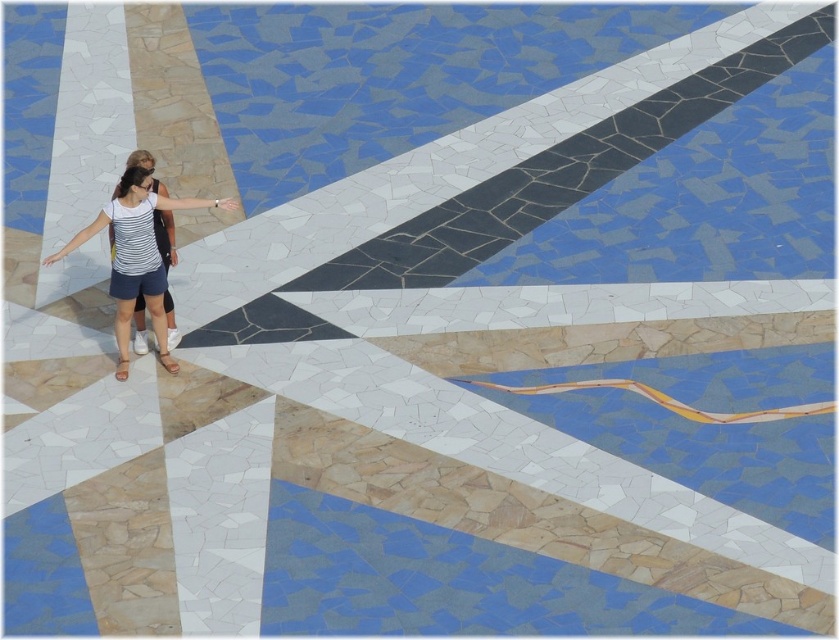
You are standing in the plaza and see the striped fabric top at center and the light brown leather sandal at lower left. Which object is closer to you?

The striped fabric top at center is closer to you because it is in front of the light brown leather sandal at lower left.

You are a photographer trying to capture the vibrant floor pattern. You notice the striped fabric top at center and the brown leather sandal at lower center in your frame. Which object is closer to the left edge of your photo?

The striped fabric top at center is positioned on the left side of brown leather sandal at lower center, so it is closer to the left edge of the photo.